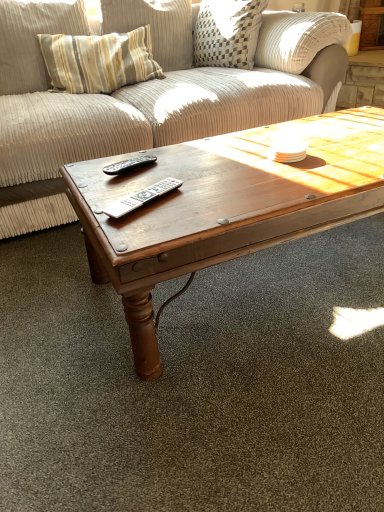
At what (x,y) coordinates should I click in order to perform the action: click on vacant area that lies to the right of silver metallic remote at center, marked as the second remote in a top-to-bottom arrangement. Please return your answer as a coordinate pair (x, y). Image resolution: width=384 pixels, height=512 pixels. Looking at the image, I should click on (209, 197).